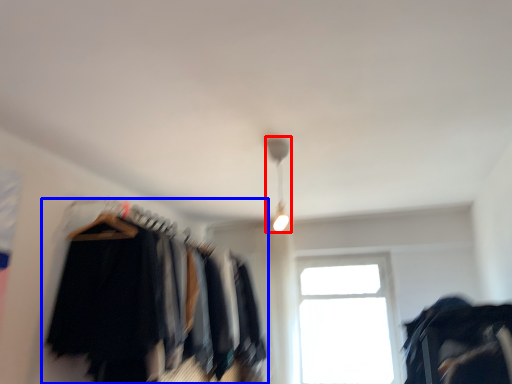
Question: Which point is further to the camera, lamp (highlighted by a red box) or closet (highlighted by a blue box)?

Choices:
 (A) lamp
 (B) closet

Answer: (A)